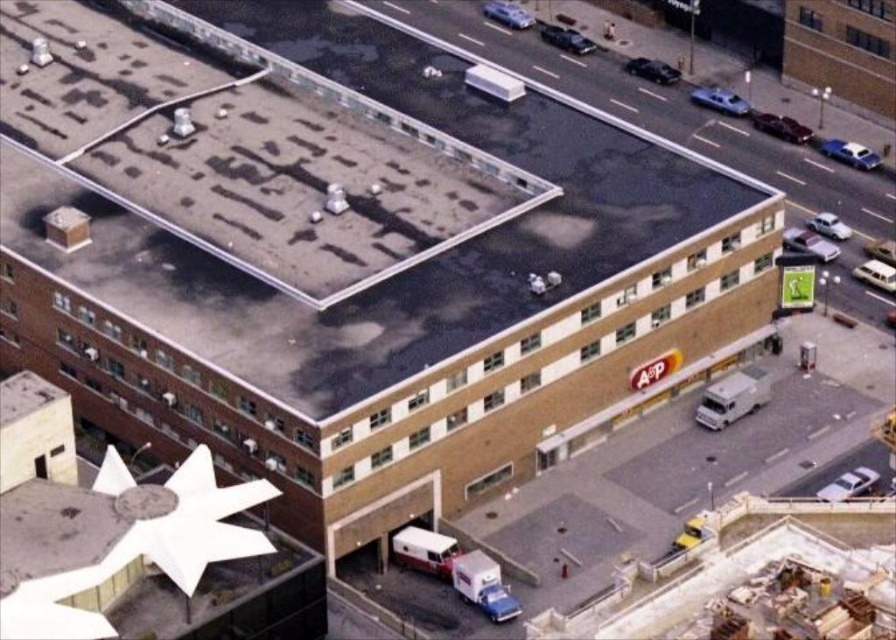
Does point (714, 97) lie in front of point (484, 8)?

That is True.

Which is above, silver metallic sedan at upper right or metallic blue car at upper center?

metallic blue car at upper center is higher up.

Between point (717, 92) and point (483, 10), which one is positioned in front?

Positioned in front is point (717, 92).

Image resolution: width=896 pixels, height=640 pixels. I want to click on silver metallic sedan at upper right, so click(x=720, y=100).

Is silver metallic sedan at right further to the viewer compared to shiny black car at center?

No, silver metallic sedan at right is closer to the viewer.

I want to click on silver metallic sedan at right, so click(x=808, y=243).

This screenshot has width=896, height=640. I want to click on silver metallic sedan at right, so click(808, 243).

Is shiny black sedan at upper right to the right of white matte car at upper right from the viewer's perspective?

No, shiny black sedan at upper right is not to the right of white matte car at upper right.

What are the coordinates of `shiny black sedan at upper right` in the screenshot? It's located at (652, 70).